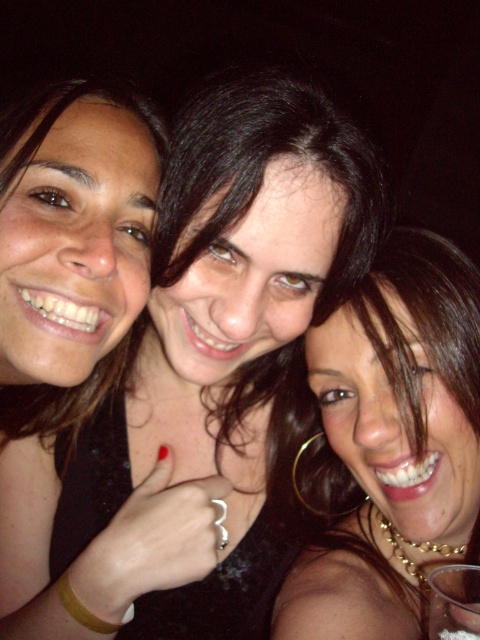
Consider the image. Does transparent glass at lower right appear under clear plastic cup at lower right?

Actually, transparent glass at lower right is above clear plastic cup at lower right.

Can you confirm if transparent glass at lower right is positioned to the left of clear plastic cup at lower right?

No, transparent glass at lower right is not to the left of clear plastic cup at lower right.

This screenshot has width=480, height=640. Describe the element at coordinates (454, 602) in the screenshot. I see `transparent glass at lower right` at that location.

The width and height of the screenshot is (480, 640). I want to click on transparent glass at lower right, so click(x=454, y=602).

Where is `gold hoop earring at upper center`? The width and height of the screenshot is (480, 640). gold hoop earring at upper center is located at coordinates (389, 444).

Who is taller, gold hoop earring at upper center or transparent glass at lower right?

Standing taller between the two is gold hoop earring at upper center.

Does gold hoop earring at upper center appear on the left side of transparent glass at lower right?

Indeed, gold hoop earring at upper center is positioned on the left side of transparent glass at lower right.

Between point (420, 252) and point (475, 568), which one is positioned in front?

Positioned in front is point (475, 568).

Find the location of `gold hoop earring at upper center`. gold hoop earring at upper center is located at coordinates (389, 444).